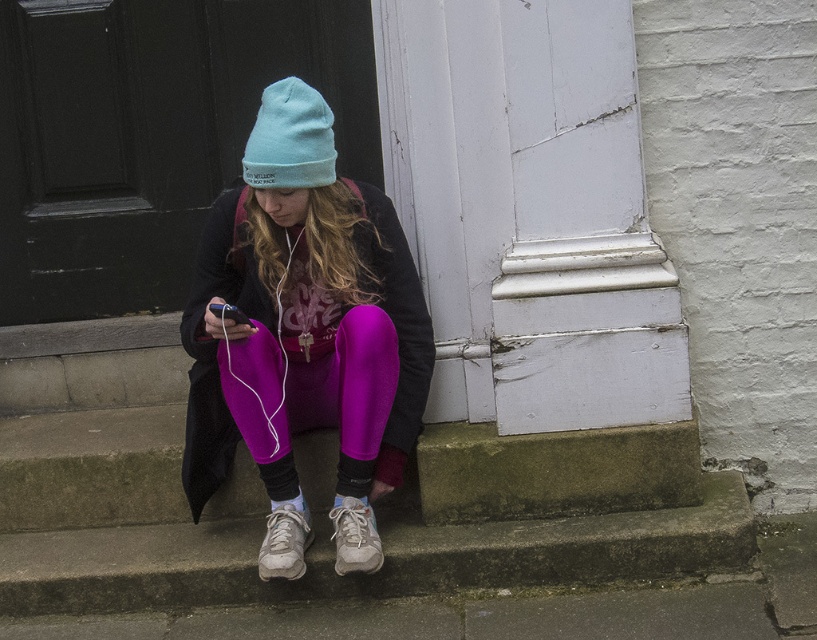
You are a fashion designer observing the image. You notice the purple fleece leggings at center and the white leather sneaker at lower center. Which item is located to the right of the other?

The purple fleece leggings at center is positioned on the right side of white leather sneaker at lower center.

You are standing in front of the door and want to walk towards the person sitting on the concrete steps. Which point, point [163,538] or point [331,112], is closer to you as you approach?

Point [163,538] is closer to you because it is further to the viewer than point [331,112].

From the picture: You are taking a photo of the scene and want to ensure both points are in focus. Given that the camera can only focus sharply within a 0.1 unit depth range, will both point (x=302, y=163) and point (x=351, y=497) be in focus?

Point (x=302, y=163) is closer to the camera than point (x=351, y=497). Since the depth range is 0.1 units, the distance between them is 0.777 minus 0.256 equals 0.521 units, which exceeds the 0.1 unit limit. Therefore, both points cannot be in focus simultaneously.